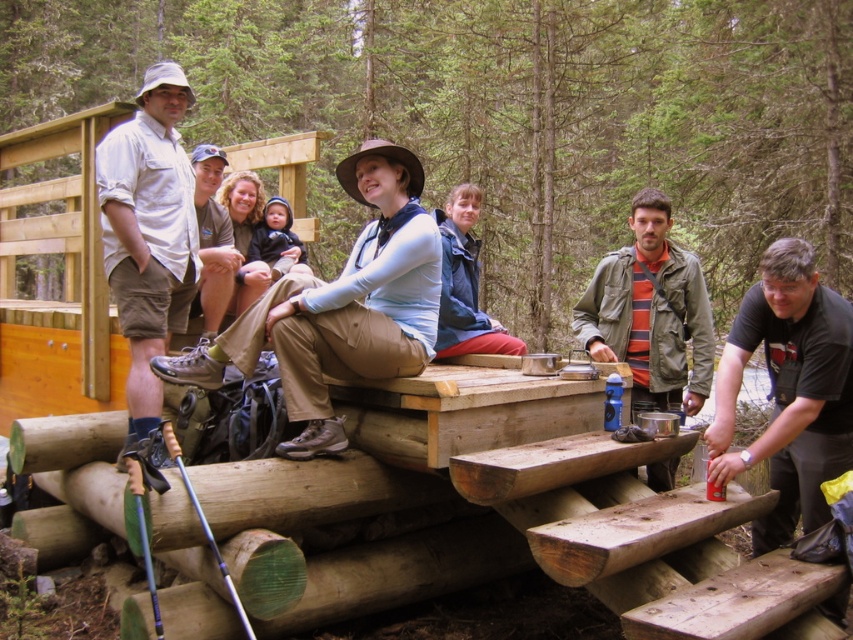
Question: Which object is positioned closest to the green wood bench at center?

Choices:
 (A) striped cotton shirt at center
 (B) khaki cotton pants at center

Answer: (A)

Question: Which point is farther from the camera taking this photo?

Choices:
 (A) (676, 385)
 (B) (792, 285)

Answer: (A)

Question: Is green wood bench at center to the right of white cotton shirt at left from the viewer's perspective?

Choices:
 (A) no
 (B) yes

Answer: (A)

Question: Among these objects, which one is nearest to the camera?

Choices:
 (A) striped cotton shirt at center
 (B) khaki pants at center

Answer: (A)

Question: Does black matte shirt at lower right have a smaller size compared to white cotton shirt at left?

Choices:
 (A) yes
 (B) no

Answer: (A)

Question: Does green wood bench at center have a larger size compared to blue fabric jacket at center?

Choices:
 (A) no
 (B) yes

Answer: (B)